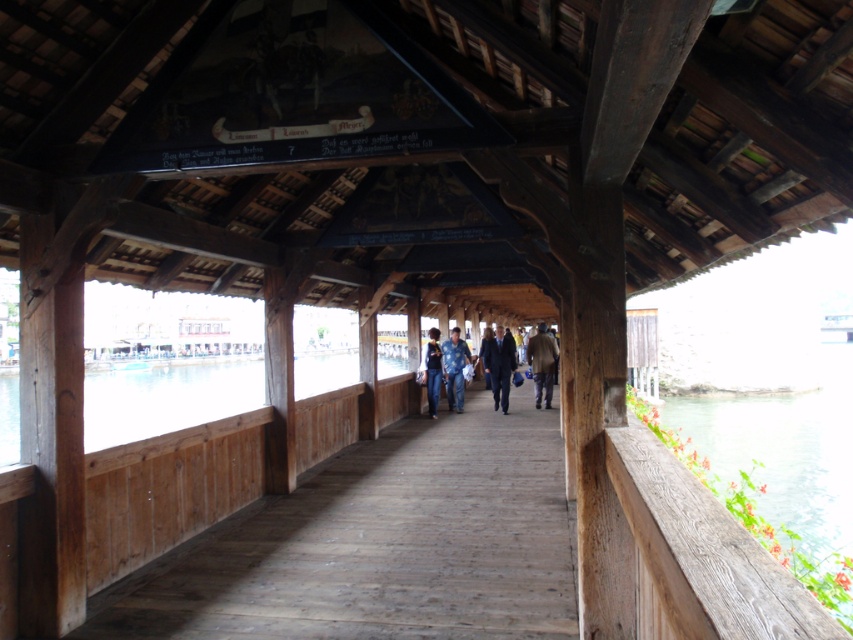
Question: Does wooden walkway at center appear under transparent glass water at center?

Choices:
 (A) yes
 (B) no

Answer: (B)

Question: Is wooden walkway at center closer to the viewer compared to blue denim jeans at center?

Choices:
 (A) yes
 (B) no

Answer: (A)

Question: Which point is farther to the camera?

Choices:
 (A) blue denim jeans at center
 (B) brown leather jacket at center
 (C) wooden walkway at center
 (D) dark blue suit at center

Answer: (D)

Question: Which point is farther from the camera taking this photo?

Choices:
 (A) (453, 403)
 (B) (543, 577)
 (C) (91, 384)
 (D) (552, 365)

Answer: (C)

Question: Does wooden walkway at center come behind blue denim jeans at center?

Choices:
 (A) yes
 (B) no

Answer: (B)

Question: Which is nearer to the dark blue suit at center?

Choices:
 (A) green wooden railing at right
 (B) brown leather jacket at center
 (C) wooden walkway at center
 (D) blue jeans at center

Answer: (B)